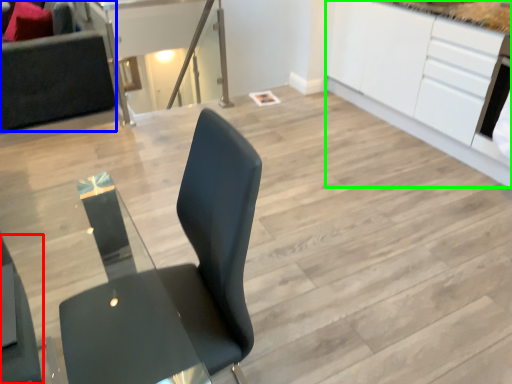
Question: Which object is positioned farthest from chair (highlighted by a red box)? Select from couch (highlighted by a blue box) and cabinetry (highlighted by a green box).

Choices:
 (A) couch
 (B) cabinetry

Answer: (B)